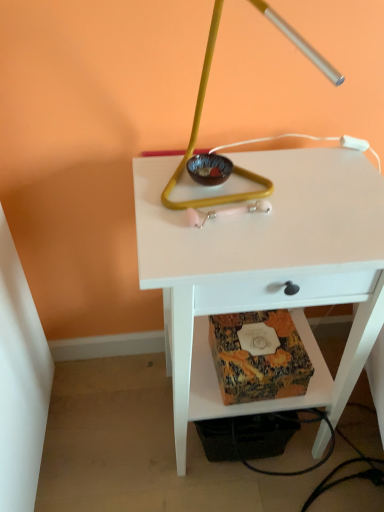
Find the location of a particular element. spots to the right of metallic gold lamp at center is located at coordinates pyautogui.click(x=329, y=196).